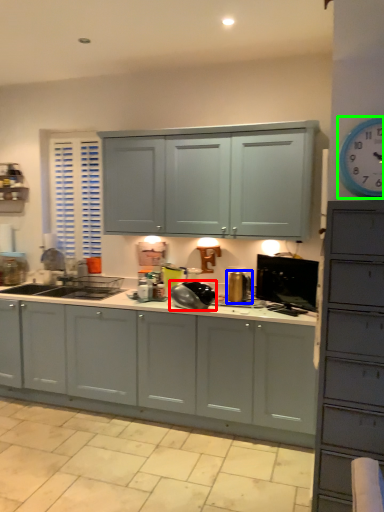
Question: Which object is the closest to the appliance (highlighted by a red box)? Choose among these: appliance (highlighted by a blue box) or clock (highlighted by a green box).

Choices:
 (A) appliance
 (B) clock

Answer: (A)